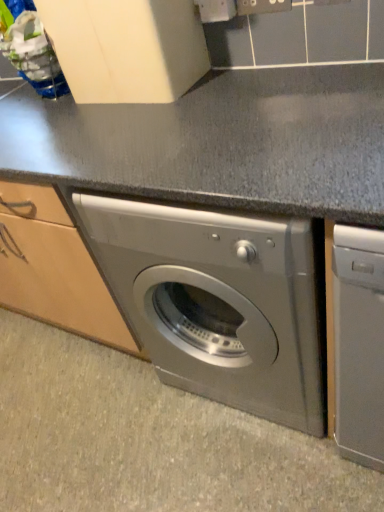
Locate an element on the screen. The width and height of the screenshot is (384, 512). vacant space positioned to the left of satin silver washing machine at center is located at coordinates (118, 419).